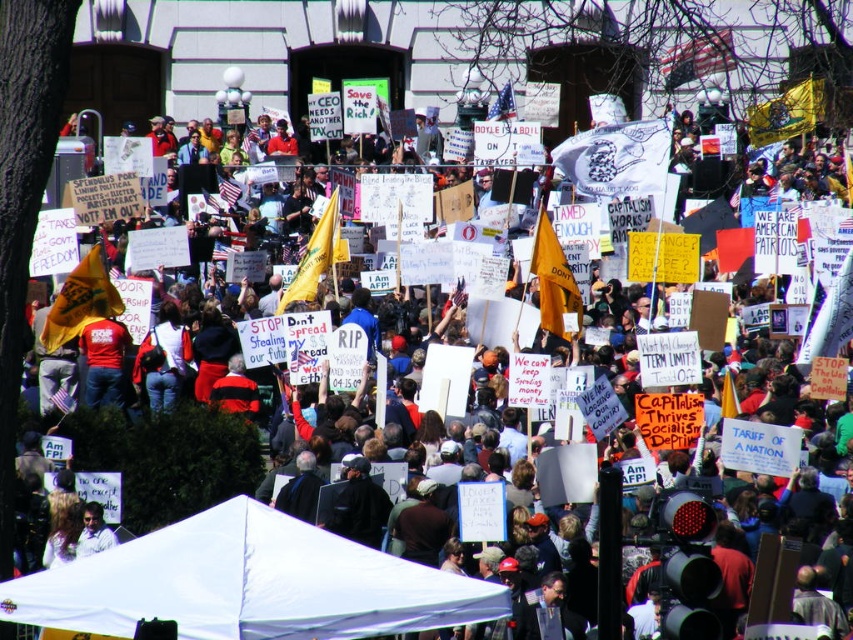
You are a photographer at the protest. You want to capture a photo that includes both the white fabric tent at center and the light brown hair at lower left. Given their sizes, which object should you focus on to ensure both are clearly visible in the frame?

The white fabric tent at center is larger than the light brown hair at lower left, so focusing on the white fabric tent at center will help ensure both objects are clearly visible in the photo.

Based on the scene description, which object is positioned lower in the image, the white fabric tent at center or the light brown hair at lower left?

The white fabric tent at center is positioned lower than the light brown hair at lower left according to the description.